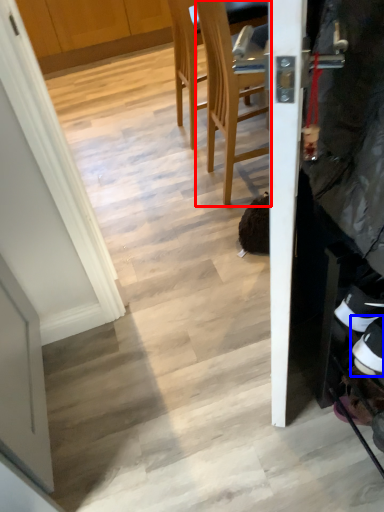
Question: Which object is further to the camera taking this photo, chair (highlighted by a red box) or footwear (highlighted by a blue box)?

Choices:
 (A) chair
 (B) footwear

Answer: (A)